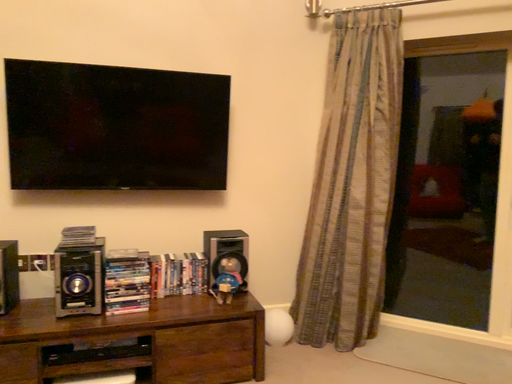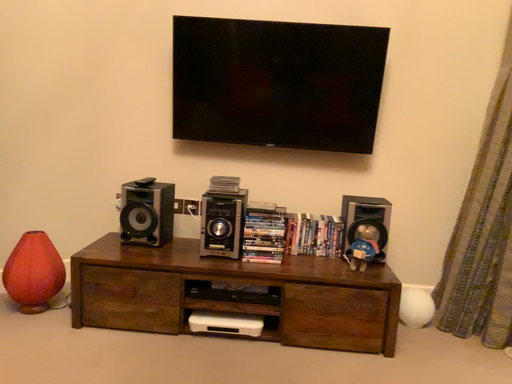
Question: How did the camera likely rotate when shooting the video?

Choices:
 (A) rotated left
 (B) rotated right

Answer: (A)